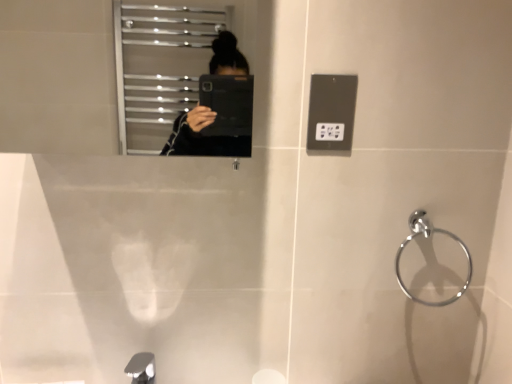
Question: Is metallic gray outlet at upper right situated inside silver metallic tap at lower left or outside?

Choices:
 (A) outside
 (B) inside

Answer: (A)

Question: Is metallic gray outlet at upper right bigger or smaller than silver metallic tap at lower left?

Choices:
 (A) big
 (B) small

Answer: (B)

Question: Considering the real-world distances, which object is closest to the silver metallic tap at lower left?

Choices:
 (A) metallic gray outlet at upper right
 (B) chrome metallic towel ring at right

Answer: (A)

Question: Which is farther from the silver metallic tap at lower left?

Choices:
 (A) chrome metallic towel ring at right
 (B) metallic gray outlet at upper right

Answer: (A)